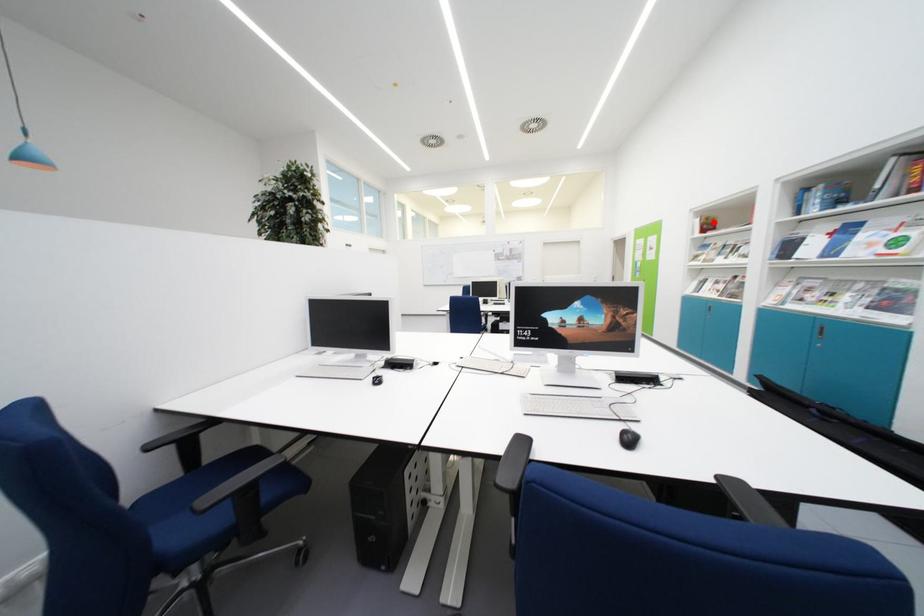
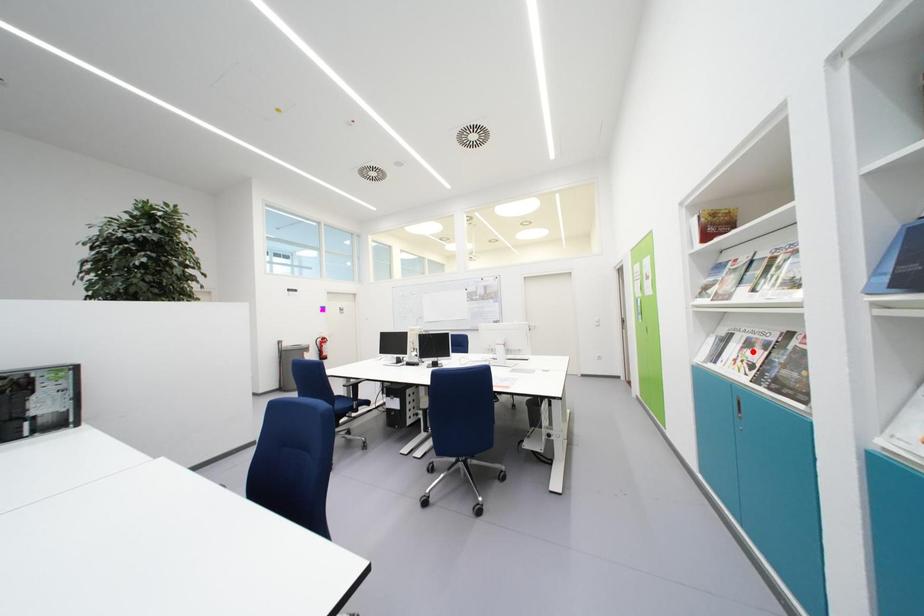
I am providing you with two images of the same scene from different viewpoints. A red point is marked on the first image and another point is marked on the second image. Do the highlighted points in image1 and image2 indicate the same real-world spot?

No